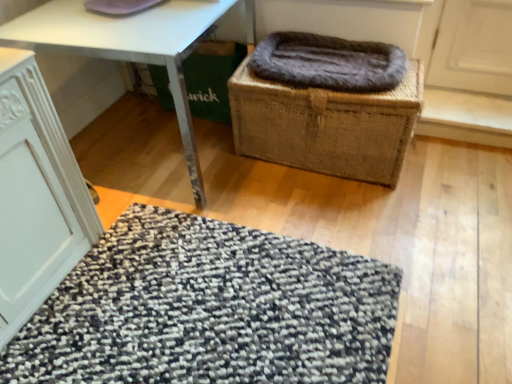
Find the location of `vacant point to the right of woven brown basket at center`. vacant point to the right of woven brown basket at center is located at coordinates (456, 175).